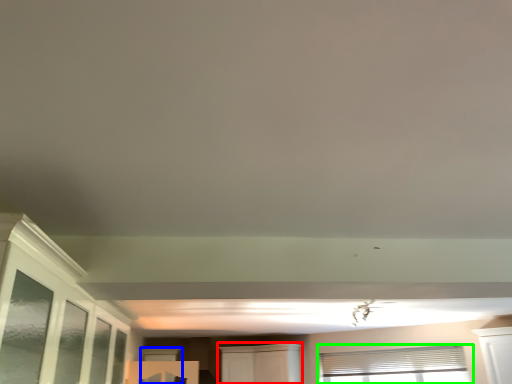
Question: Considering the real-world distances, which object is farthest from cabinetry (highlighted by a red box)? window (highlighted by a blue box) or window (highlighted by a green box)?

Choices:
 (A) window
 (B) window

Answer: (A)